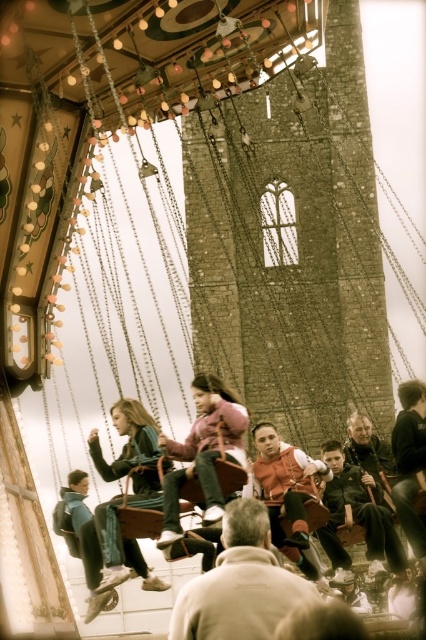
What do you see at coordinates (357, 515) in the screenshot? I see `dark brown leather jacket at center` at bounding box center [357, 515].

Based on the photo, can you confirm if dark brown leather jacket at center is smaller than matte pink sweater at center?

Indeed, dark brown leather jacket at center has a smaller size compared to matte pink sweater at center.

You are a GUI agent. You are given a task and a screenshot of the screen. Output one action in this format:
    pyautogui.click(x=<x>, y=<y>)
    Task: Click on the dark brown leather jacket at center
    The height and width of the screenshot is (640, 426).
    Given the screenshot: What is the action you would take?
    pyautogui.click(x=357, y=515)

The height and width of the screenshot is (640, 426). I want to click on dark brown leather jacket at center, so pos(357,515).

Can you confirm if light brown leather jacket at center is positioned to the left of dark brown leather jacket at center?

Yes, light brown leather jacket at center is to the left of dark brown leather jacket at center.

Which is in front, point (265, 545) or point (351, 515)?

Point (265, 545)

Identify the location of light brown leather jacket at center. (239, 582).

Can you confirm if pink fleece jacket at center is bigger than matte pink sweater at center?

Actually, pink fleece jacket at center might be smaller than matte pink sweater at center.

Between point (176, 492) and point (108, 588), which one is positioned behind?

The point (176, 492) is behind.

At what (x,y) coordinates should I click in order to perform the action: click on pink fleece jacket at center. Please return your answer as a coordinate pair (x, y). The image size is (426, 640). Looking at the image, I should click on (204, 451).